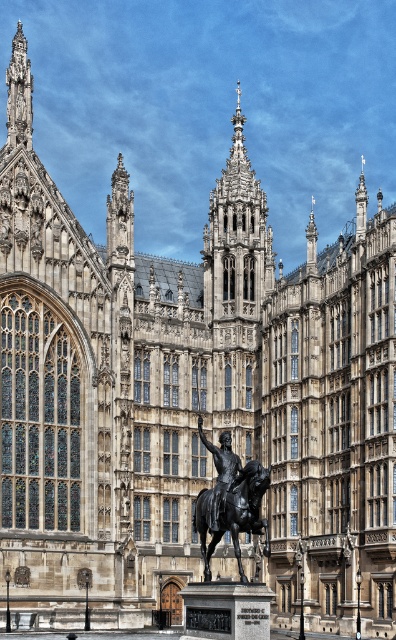
You are standing in front of the grand architectural structure described. You want to take a photo of the stone gothic tower at center. Considering the distance, will you need to use a zoom lens to capture the entire tower in your photo?

The stone gothic tower at center is 96.37 meters from viewer, so you will need a zoom lens to capture the entire tower in your photo from that distance.

You are an architect examining the building and its statue. Which object is positioned higher in the scene, the stone gothic tower at center or the polished bronze horse at center?

The stone gothic tower at center is located above the polished bronze horse at center, so the tower is positioned higher.

You are an architect planning to install a new decorative element between the stone gothic tower at center and the polished bronze horse at center. To ensure symmetry, you need to know which object is wider. Which one is wider?

The stone gothic tower at center is wider than the polished bronze horse at center according to the description.